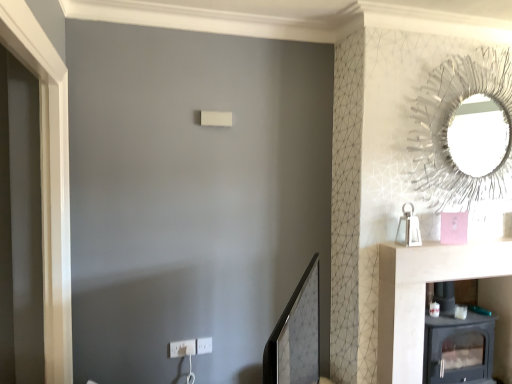
Question: Is metallic wire at upper right, the 1th mirror in the right-to-left sequence, bigger or smaller than white plastic electric outlet at lower center, which is the 1th electric outlet in right-to-left order?

Choices:
 (A) big
 (B) small

Answer: (A)

Question: Visually, is metallic wire at upper right, which appears as the 1th mirror when viewed from the back, positioned to the left or to the right of white plastic electric outlet at lower center, acting as the 2th electric outlet starting from the left?

Choices:
 (A) right
 (B) left

Answer: (A)

Question: Estimate the real-world distances between objects in this image. Which object is farther from the black matte wood stove at lower right?

Choices:
 (A) white plastic electric outlet at lower center, acting as the 2th electric outlet starting from the left
 (B) white plastic electric outlet at lower center, which is counted as the 2th electric outlet, starting from the right
 (C) matte black mirror at center, positioned as the 1th mirror in bottom-to-top order
 (D) metallic wire at upper right, which appears as the 1th mirror when viewed from the back

Answer: (B)

Question: Which object is the closest to the white plastic electric outlet at lower center, which is counted as the 2th electric outlet, starting from the right?

Choices:
 (A) black matte wood stove at lower right
 (B) metallic wire at upper right, the 1th mirror in the right-to-left sequence
 (C) matte black mirror at center, the 1th mirror positioned from the left
 (D) white plastic electric outlet at lower center, which is the 1th electric outlet in right-to-left order

Answer: (D)